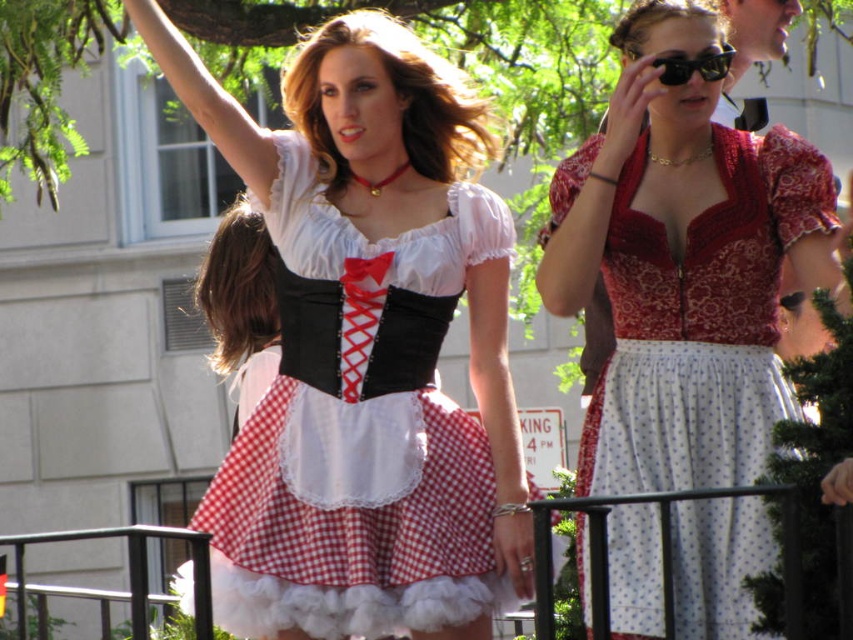
Question: In this image, where is red lace dress at center located relative to black metal rail at lower center?

Choices:
 (A) above
 (B) below

Answer: (A)

Question: Does black metal rail at lower center appear under black plastic goggles at upper center?

Choices:
 (A) no
 (B) yes

Answer: (B)

Question: Which object appears farthest from the camera in this image?

Choices:
 (A) black metal rail at lower center
 (B) black plastic goggles at upper center
 (C) red lace dress at center
 (D) red checkered dress at center

Answer: (B)

Question: Where is red checkered dress at center located in relation to red lace dress at center in the image?

Choices:
 (A) below
 (B) above

Answer: (A)

Question: Which of the following is the closest to the observer?

Choices:
 (A) (312, 525)
 (B) (621, 499)
 (C) (613, 616)

Answer: (B)

Question: Which of the following is the closest to the observer?

Choices:
 (A) (688, 58)
 (B) (592, 593)

Answer: (B)